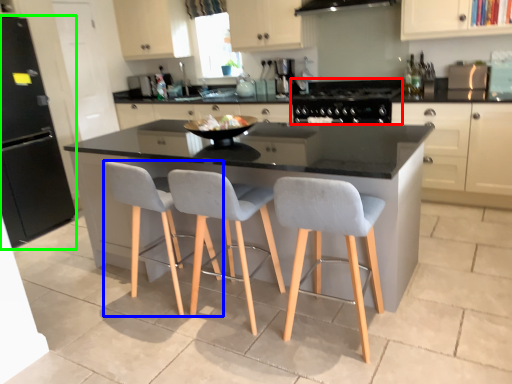
Question: Based on their relative distances, which object is nearer to gas stove (highlighted by a red box)? Choose from chair (highlighted by a blue box) and appliance (highlighted by a green box).

Choices:
 (A) chair
 (B) appliance

Answer: (A)